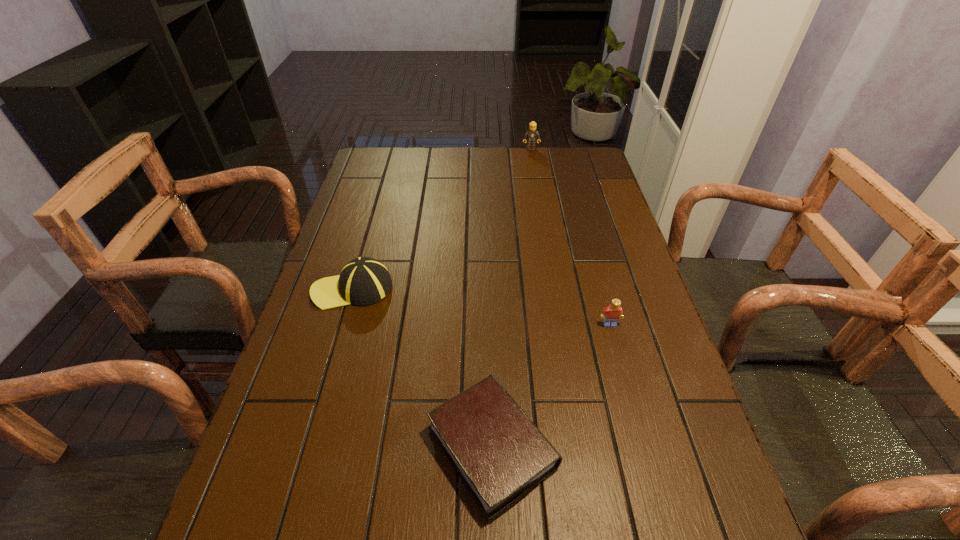
Find the location of a particular element. The height and width of the screenshot is (540, 960). the taller Lego is located at coordinates (531, 135).

The height and width of the screenshot is (540, 960). What are the coordinates of `the farthest object` in the screenshot? It's located at (531, 135).

Locate an element on the screen. The height and width of the screenshot is (540, 960). baseball cap is located at coordinates (363, 281).

Image resolution: width=960 pixels, height=540 pixels. I want to click on the third nearest object, so click(363, 281).

The width and height of the screenshot is (960, 540). I want to click on the rightmost object, so pos(611,314).

The image size is (960, 540). What are the coordinates of `the right Lego` in the screenshot? It's located at (611, 314).

Locate an element on the screen. Bible is located at coordinates (500, 455).

Identify the location of the nearest object. (500, 455).

Where is `free region located in front of the farther Lego`? free region located in front of the farther Lego is located at coordinates (541, 212).

This screenshot has width=960, height=540. I want to click on blank space located 0.060m on the front-facing side of the shorter Lego, so click(616, 348).